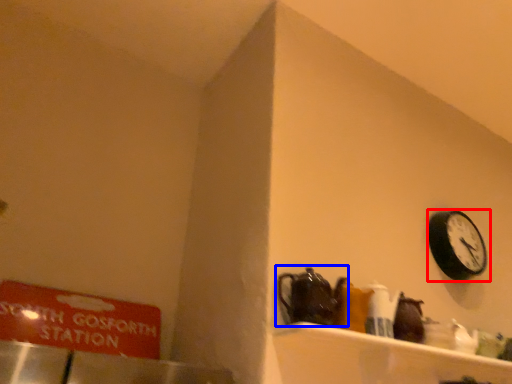
Question: Which of the following is the farthest to the observer, wall clock (highlighted by a red box) or tea pot (highlighted by a blue box)?

Choices:
 (A) wall clock
 (B) tea pot

Answer: (A)